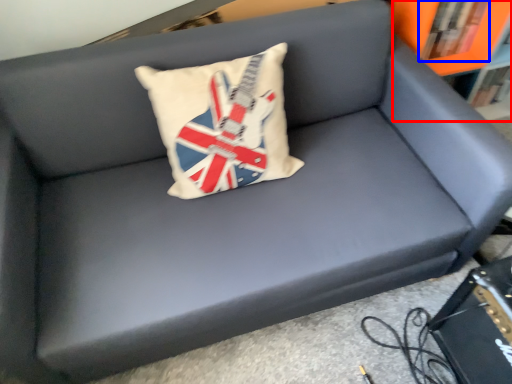
Question: Among these objects, which one is nearest to the camera, bookcase (highlighted by a red box) or book (highlighted by a blue box)?

Choices:
 (A) bookcase
 (B) book

Answer: (A)